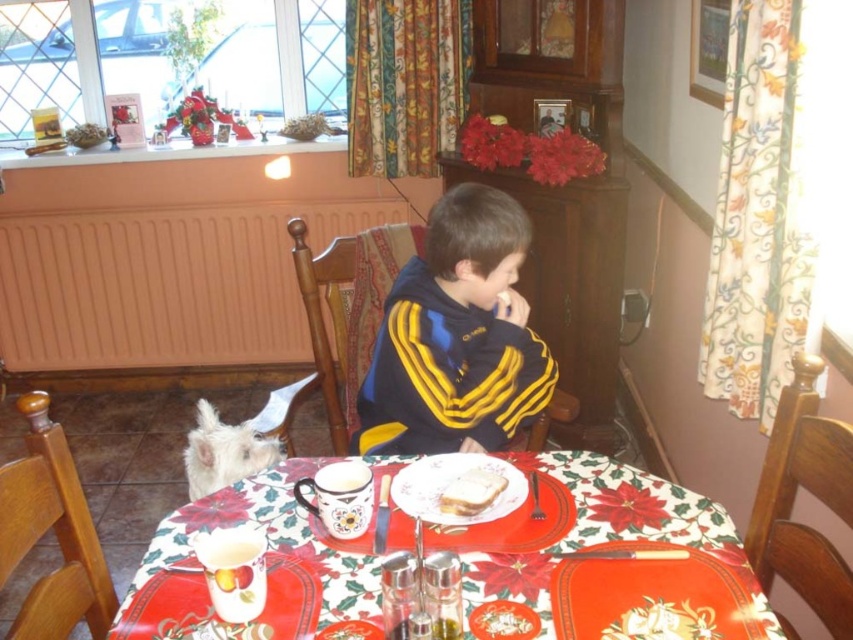
You are a guest at this table and want to place your phone between the white fur dog at lower left and the white bread at center. Can you fit your phone there?

The white fur dog at lower left is larger in size than the white bread at center, so there might be enough space between them to place your phone.